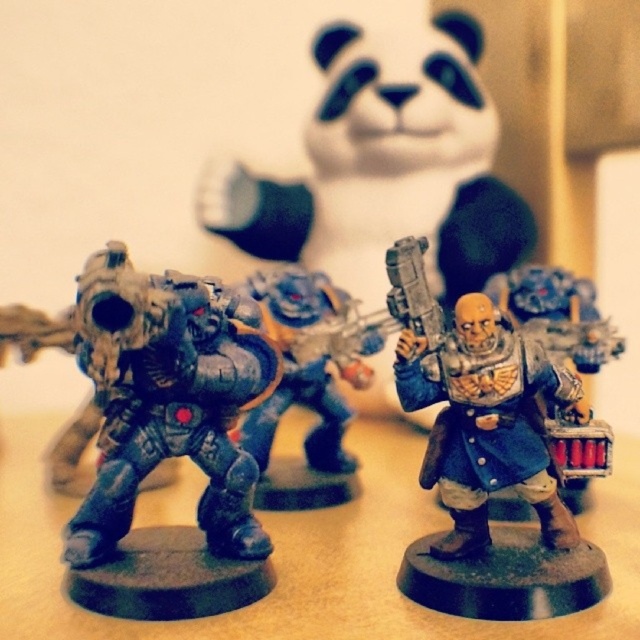
Question: Which object is closer to the camera taking this photo?

Choices:
 (A) matte black figurine at center
 (B) metallic blue figure at center
 (C) metallic blue power armor at center
 (D) matte black figure at center

Answer: (A)

Question: Is metallic blue figure at center to the right of matte black figurine at center from the viewer's perspective?

Choices:
 (A) no
 (B) yes

Answer: (B)

Question: Estimate the real-world distances between objects in this image. Which object is farther from the metallic blue power armor at center?

Choices:
 (A) metallic blue figure at center
 (B) matte black figure at center
 (C) matte blue armor at center
 (D) matte black figurine at center

Answer: (C)

Question: Which point appears closest to the camera in this image?

Choices:
 (A) (252, 445)
 (B) (486, 164)
 (C) (500, 294)
 (D) (65, 625)

Answer: (D)

Question: Can you confirm if metallic blue figure at center is wider than metallic blue power armor at center?

Choices:
 (A) yes
 (B) no

Answer: (A)

Question: Can you confirm if matte black figurine at center is positioned to the right of matte black figure at center?

Choices:
 (A) yes
 (B) no

Answer: (B)